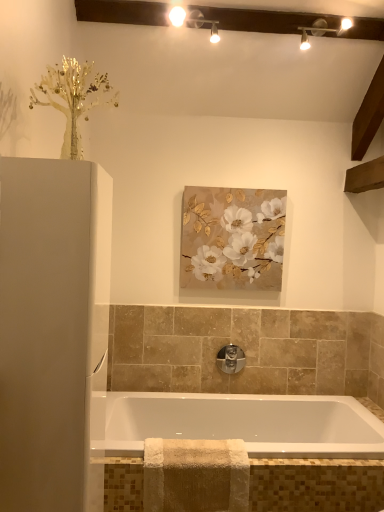
Question: Does white glossy bathtub at center have a greater width compared to matte gold and white floral painting at center?

Choices:
 (A) yes
 (B) no

Answer: (A)

Question: Considering the relative positions of white glossy bathtub at center and matte gold and white floral painting at center in the image provided, is white glossy bathtub at center to the right of matte gold and white floral painting at center from the viewer's perspective?

Choices:
 (A) yes
 (B) no

Answer: (A)

Question: Can you confirm if white glossy bathtub at center is smaller than matte gold and white floral painting at center?

Choices:
 (A) no
 (B) yes

Answer: (A)

Question: Would you say white glossy bathtub at center is outside matte gold and white floral painting at center?

Choices:
 (A) yes
 (B) no

Answer: (A)

Question: From a real-world perspective, is white glossy bathtub at center located higher than matte gold and white floral painting at center?

Choices:
 (A) no
 (B) yes

Answer: (A)

Question: Is white glossy bathtub at center to the left of matte gold and white floral painting at center from the viewer's perspective?

Choices:
 (A) no
 (B) yes

Answer: (A)

Question: From a real-world perspective, does matte gold and white floral painting at center stand above white glossy cabinet at left?

Choices:
 (A) no
 (B) yes

Answer: (B)

Question: Is matte gold and white floral painting at center behind white glossy cabinet at left?

Choices:
 (A) no
 (B) yes

Answer: (B)

Question: From the image's perspective, is matte gold and white floral painting at center located beneath white glossy cabinet at left?

Choices:
 (A) yes
 (B) no

Answer: (B)

Question: From a real-world perspective, is matte gold and white floral painting at center beneath white glossy cabinet at left?

Choices:
 (A) no
 (B) yes

Answer: (A)

Question: Is matte gold and white floral painting at center far away from white glossy cabinet at left?

Choices:
 (A) yes
 (B) no

Answer: (A)

Question: Is matte gold and white floral painting at center next to white glossy cabinet at left?

Choices:
 (A) yes
 (B) no

Answer: (B)

Question: Is satin nickel faucet at center not within matte gold and white floral painting at center?

Choices:
 (A) no
 (B) yes

Answer: (B)